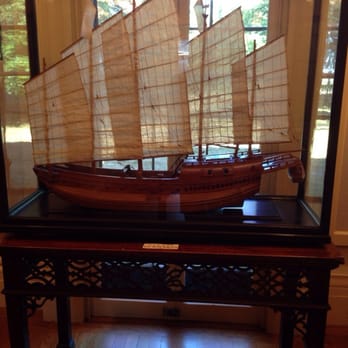
The image size is (348, 348). Find the location of `bottom of door`. bottom of door is located at coordinates coord(219,315).